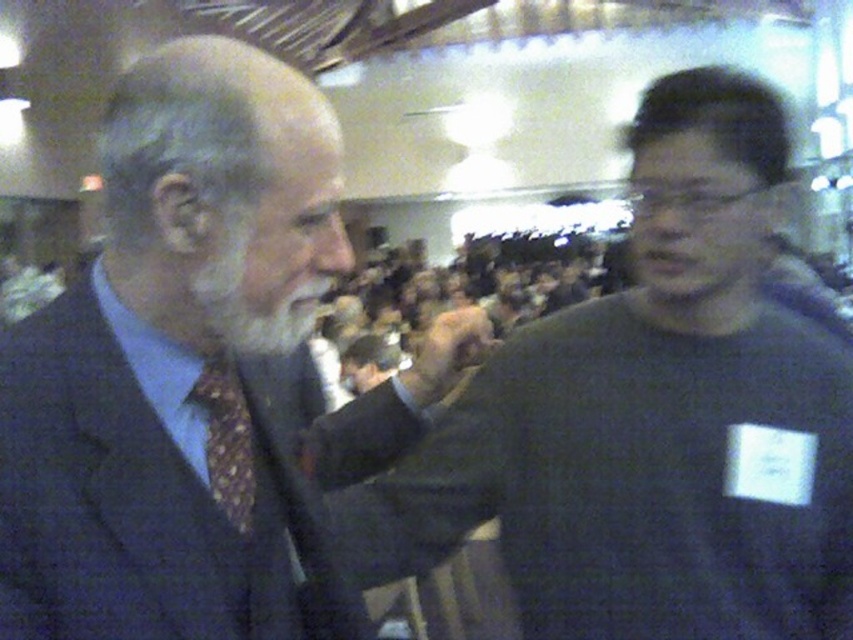
Question: Which point is farther to the camera?

Choices:
 (A) dark blue suit at left
 (B) white matte beard at left

Answer: (B)

Question: Is dark blue suit at left further to the viewer compared to matte black hand at center?

Choices:
 (A) yes
 (B) no

Answer: (B)

Question: Is dark blue suit at left wider than white matte beard at left?

Choices:
 (A) no
 (B) yes

Answer: (B)

Question: Among these objects, which one is nearest to the camera?

Choices:
 (A) dark blue suit at left
 (B) dark gray sweater at right
 (C) patterned silk tie at left
 (D) white matte beard at left

Answer: (A)

Question: Which object appears closest to the camera in this image?

Choices:
 (A) dark blue suit at left
 (B) dark gray sweater at right

Answer: (A)

Question: Does dark blue suit at left appear under patterned silk tie at left?

Choices:
 (A) yes
 (B) no

Answer: (B)